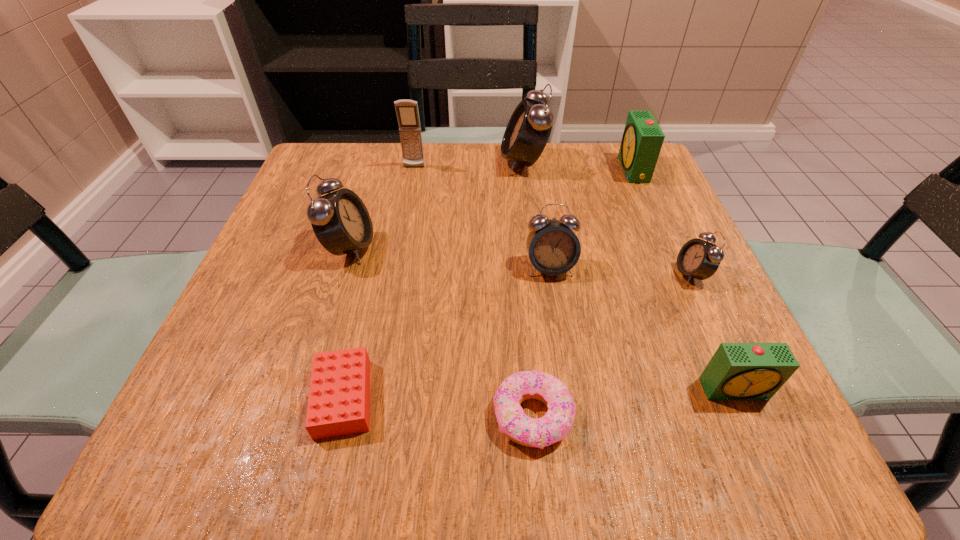
I want to click on free space located 0.360m on the front-facing side of the bigger green alarm clock, so click(x=467, y=170).

At what (x,y) coordinates should I click in order to perform the action: click on vacant space located 0.400m on the face of the smallest white alarm clock. Please return your answer as a coordinate pair (x, y). Looking at the image, I should click on (452, 274).

Where is `vacant area located 0.290m on the face of the smallest white alarm clock`? This screenshot has width=960, height=540. vacant area located 0.290m on the face of the smallest white alarm clock is located at coordinates (514, 274).

Where is `free space located on the face of the smallest white alarm clock`? The image size is (960, 540). free space located on the face of the smallest white alarm clock is located at coordinates (587, 274).

Find the location of a particular element. free space located on the front-facing side of the smaller green alarm clock is located at coordinates (763, 451).

Identify the location of vacant space positioned on the right of the Lego. (518, 398).

Where is `vacant space situated 0.340m on the back of the doughnut`? Image resolution: width=960 pixels, height=540 pixels. vacant space situated 0.340m on the back of the doughnut is located at coordinates (516, 230).

Image resolution: width=960 pixels, height=540 pixels. In order to click on cellular telephone located at the far edge in this screenshot , I will do `click(407, 112)`.

Image resolution: width=960 pixels, height=540 pixels. I want to click on alarm clock that is at the near edge, so click(x=737, y=371).

Identify the location of Lego that is at the near edge. Image resolution: width=960 pixels, height=540 pixels. (339, 396).